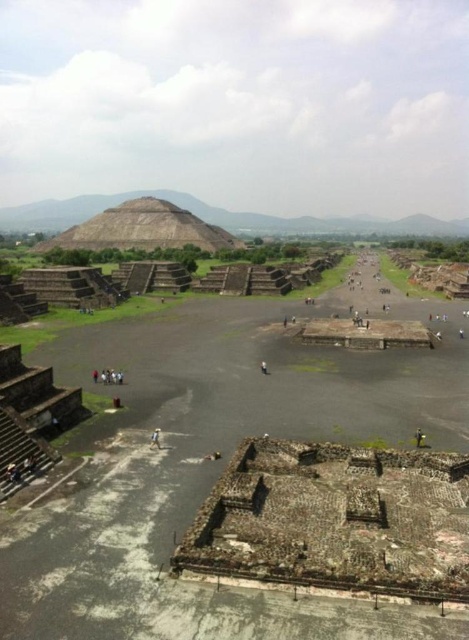
You are standing at the point labeled point (261, 362) in the Plaza of the Sun at Teotihuacan. You want to walk to the Pyramid of the Sun, which is in the background. Is the point labeled point (83, 228) located between you and the Pyramid of the Sun?

Yes, the point labeled point (83, 228) is located between you and the Pyramid of the Sun because it is behind point (261, 362), which is your current position.

Looking at this image, you are standing at the Pyramid of the Sun in Teotihuacan and notice a point marked at coordinates (154,438). What does this point indicate?

The point at (154,438) marks a blurred human figure at center.